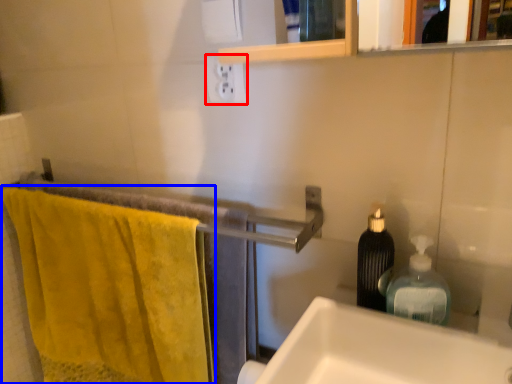
Question: Which of the following is the farthest to the observer, electric outlet (highlighted by a red box) or bath towel (highlighted by a blue box)?

Choices:
 (A) electric outlet
 (B) bath towel

Answer: (A)